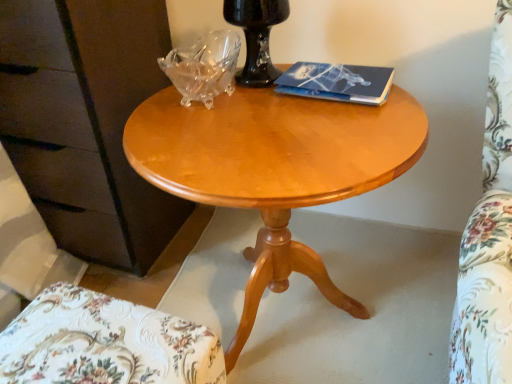
Where is `black glass vase at upper center`? The width and height of the screenshot is (512, 384). black glass vase at upper center is located at coordinates (256, 37).

Locate an element on the screen. The width and height of the screenshot is (512, 384). black glass vase at upper center is located at coordinates (256, 37).

Is light wood/finish coffee table at center bigger than blue matte paper at upper right?

Yes.

Where is `paperback book to the right of light wood/finish coffee table at center`? This screenshot has height=384, width=512. paperback book to the right of light wood/finish coffee table at center is located at coordinates (337, 82).

Which of these two, light wood/finish coffee table at center or blue matte paper at upper right, stands taller?

light wood/finish coffee table at center is taller.

From the picture: From a real-world perspective, who is located lower, light wood/finish coffee table at center or blue matte paper at upper right?

→ light wood/finish coffee table at center.

From a real-world perspective, is white floral fabric chair at lower left located beneath blue matte paper at upper right?

Yes.

From the image's perspective, does white floral fabric chair at lower left appear lower than blue matte paper at upper right?

Indeed, from the image's perspective, white floral fabric chair at lower left is shown beneath blue matte paper at upper right.

From the picture: What's the angular difference between white floral fabric chair at lower left and blue matte paper at upper right's facing directions?

173 degrees separate the facing orientations of white floral fabric chair at lower left and blue matte paper at upper right.

Is white floral fabric chair at lower left facing towards blue matte paper at upper right?

No.

Which is behind, white floral fabric chair at lower left or matte brown dresser at left?

matte brown dresser at left is more distant.

Is point (38, 319) closer to camera compared to point (15, 108)?

Yes, it is in front of point (15, 108).

From the image's perspective, is white floral fabric chair at lower left located beneath matte brown dresser at left?

Indeed, from the image's perspective, white floral fabric chair at lower left is shown beneath matte brown dresser at left.

The height and width of the screenshot is (384, 512). I want to click on chair that is below the matte brown dresser at left (from the image's perspective), so click(105, 343).

Is black glass vase at upper center thinner than matte brown dresser at left?

Yes, black glass vase at upper center is thinner than matte brown dresser at left.

Locate an element on the screen. This screenshot has height=384, width=512. dresser on the left of the black glass vase at upper center is located at coordinates (86, 122).

Can you confirm if black glass vase at upper center is shorter than matte brown dresser at left?

Correct, black glass vase at upper center is not as tall as matte brown dresser at left.

Would you say black glass vase at upper center is to the left or to the right of matte brown dresser at left in the picture?

In the image, black glass vase at upper center appears on the right side of matte brown dresser at left.

Who is shorter, matte brown dresser at left or white floral fabric chair at lower left?

With less height is white floral fabric chair at lower left.

Consider the image. Which object is wider, matte brown dresser at left or white floral fabric chair at lower left?

matte brown dresser at left.

Looking at this image, can you see matte brown dresser at left touching white floral fabric chair at lower left?

They are not placed beside each other.

Between matte brown dresser at left and white floral fabric chair at lower left, which one is positioned in front?

white floral fabric chair at lower left is closer to the camera.

Considering the positions of objects matte brown dresser at left and light wood/finish coffee table at center in the image provided, who is more to the right, matte brown dresser at left or light wood/finish coffee table at center?

light wood/finish coffee table at center is more to the right.

From the image's perspective, is matte brown dresser at left on top of light wood/finish coffee table at center?

Indeed, from the image's perspective, matte brown dresser at left is shown above light wood/finish coffee table at center.

Consider the image. Is matte brown dresser at left not close to light wood/finish coffee table at center?

Actually, matte brown dresser at left and light wood/finish coffee table at center are a little close together.

Who is taller, matte brown dresser at left or light wood/finish coffee table at center?

matte brown dresser at left.

Does black glass vase at upper center appear on the left side of white floral fabric chair at lower left?

Incorrect, black glass vase at upper center is not on the left side of white floral fabric chair at lower left.

Is black glass vase at upper center directly adjacent to white floral fabric chair at lower left?

black glass vase at upper center and white floral fabric chair at lower left are clearly separated.

Which is in front, black glass vase at upper center or white floral fabric chair at lower left?

white floral fabric chair at lower left is more forward.

Between black glass vase at upper center and white floral fabric chair at lower left, which one has larger width?

white floral fabric chair at lower left is wider.

Find the location of `paperback book above the light wood/finish coffee table at center (from a real-world perspective)`. paperback book above the light wood/finish coffee table at center (from a real-world perspective) is located at coordinates (337, 82).

I want to click on paperback book above the white floral fabric chair at lower left (from the image's perspective), so click(x=337, y=82).

From the image, which object appears to be farther from light wood/finish coffee table at center, white floral fabric chair at lower left or black glass vase at upper center?

Based on the image, white floral fabric chair at lower left appears to be further to light wood/finish coffee table at center.

Based on their spatial positions, is blue matte paper at upper right or white floral fabric chair at lower left closer to black glass vase at upper center?

blue matte paper at upper right is closer to black glass vase at upper center.

Based on their spatial positions, is matte brown dresser at left or blue matte paper at upper right closer to light wood/finish coffee table at center?

Among the two, blue matte paper at upper right is located nearer to light wood/finish coffee table at center.

From the picture: Based on their spatial positions, is matte brown dresser at left or blue matte paper at upper right further from black glass vase at upper center?

Based on the image, matte brown dresser at left appears to be further to black glass vase at upper center.

Estimate the real-world distances between objects in this image. Which object is further from blue matte paper at upper right, white floral fabric chair at lower left or black glass vase at upper center?

white floral fabric chair at lower left is further to blue matte paper at upper right.

Consider the image. Estimate the real-world distances between objects in this image. Which object is closer to white floral fabric chair at lower left, light wood/finish coffee table at center or black glass vase at upper center?

light wood/finish coffee table at center is closer to white floral fabric chair at lower left.

Based on their spatial positions, is blue matte paper at upper right or light wood/finish coffee table at center closer to matte brown dresser at left?

light wood/finish coffee table at center is closer to matte brown dresser at left.

Which object lies nearer to the anchor point white floral fabric chair at lower left, blue matte paper at upper right or black glass vase at upper center?

blue matte paper at upper right is closer to white floral fabric chair at lower left.

You are a GUI agent. You are given a task and a screenshot of the screen. Output one action in this format:
    pyautogui.click(x=<x>, y=<y>)
    Task: Click on the paperback book between black glass vase at upper center and white floral fabric chair at lower left in the vertical direction
    The height and width of the screenshot is (384, 512).
    Given the screenshot: What is the action you would take?
    pyautogui.click(x=337, y=82)

The width and height of the screenshot is (512, 384). I want to click on coffee table between black glass vase at upper center and white floral fabric chair at lower left in the up-down direction, so click(274, 169).

Locate an element on the screen. dresser that lies between black glass vase at upper center and white floral fabric chair at lower left from top to bottom is located at coordinates (86, 122).

Identify the location of paperback book between black glass vase at upper center and light wood/finish coffee table at center in the vertical direction. This screenshot has width=512, height=384. (337, 82).